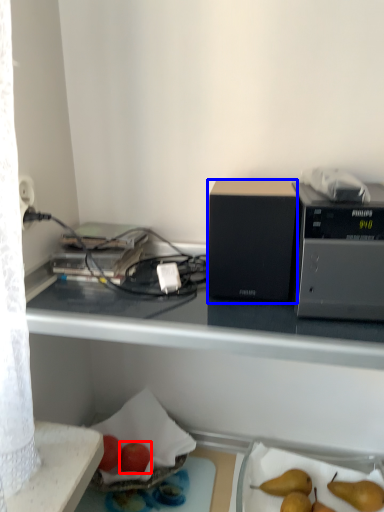
Question: Which object is closer to the camera taking this photo, apple (highlighted by a red box) or appliance (highlighted by a blue box)?

Choices:
 (A) apple
 (B) appliance

Answer: (B)